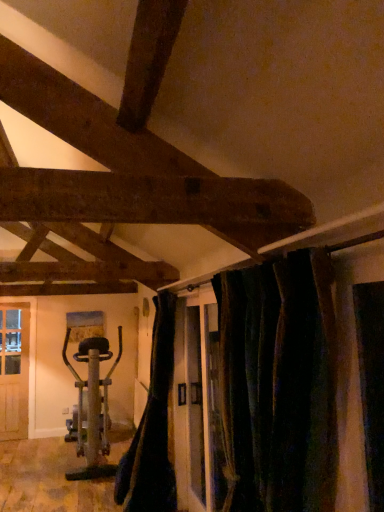
Where is `black fabric curtain at lower center, the 1th curtain when ordered from back to front`? Image resolution: width=384 pixels, height=512 pixels. black fabric curtain at lower center, the 1th curtain when ordered from back to front is located at coordinates (152, 426).

Is metallic silver exercise bike at left oriented away from black fabric curtain at lower center, the 1th curtain when ordered from back to front?

That's not correct — metallic silver exercise bike at left is not looking away from black fabric curtain at lower center, the 1th curtain when ordered from back to front.

Considering the positions of point (119, 352) and point (154, 322), is point (119, 352) closer or farther from the camera than point (154, 322)?

Point (119, 352) is positioned farther from the camera compared to point (154, 322).

Is metallic silver exercise bike at left a part of dark velvet curtains at center, which is the 1th curtain from front to back?

No, metallic silver exercise bike at left is not inside dark velvet curtains at center, which is the 1th curtain from front to back.

Does point (326, 458) come behind point (90, 425)?

No.

I want to click on sport equipment on the left of dark velvet curtains at center, which is the 1th curtain from front to back, so click(92, 402).

From the image's perspective, is dark velvet curtains at center, arranged as the second curtain when viewed from the back, positioned above or below metallic silver exercise bike at left?

dark velvet curtains at center, arranged as the second curtain when viewed from the back, is situated higher than metallic silver exercise bike at left in the image.

Find the location of a particular element. The width and height of the screenshot is (384, 512). sport equipment on the left of dark velvet curtains at center, which ranks as the 2th curtain in left-to-right order is located at coordinates (92, 402).

From the picture: Considering the relative sizes of metallic silver exercise bike at left and dark velvet curtains at center, which is the 1th curtain from front to back, in the image provided, is metallic silver exercise bike at left smaller than dark velvet curtains at center, which is the 1th curtain from front to back,?

No.

How different are the orientations of metallic silver exercise bike at left and dark velvet curtains at center, arranged as the second curtain when viewed from the back, in degrees?

metallic silver exercise bike at left and dark velvet curtains at center, arranged as the second curtain when viewed from the back, are facing 0.199 degrees away from each other.

From the image's perspective, who appears lower, metallic silver exercise bike at left or dark velvet curtains at center, the 1th curtain in the right-to-left sequence?

metallic silver exercise bike at left appears lower in the image.

From the picture: Which object is positioned more to the left, dark velvet curtains at center, which is the 1th curtain from front to back, or black fabric curtain at lower center, the 1th curtain when ordered from back to front?

Positioned to the left is black fabric curtain at lower center, the 1th curtain when ordered from back to front.

Based on the photo, from the image's perspective, is dark velvet curtains at center, which is the 1th curtain from front to back, under black fabric curtain at lower center, which appears as the second curtain when viewed from the right?

No, from the image's perspective, dark velvet curtains at center, which is the 1th curtain from front to back, is not below black fabric curtain at lower center, which appears as the second curtain when viewed from the right.

Identify the location of curtain behind the dark velvet curtains at center, arranged as the second curtain when viewed from the back. (152, 426).

Is black fabric curtain at lower center, which appears as the second curtain when viewed from the right, a part of dark velvet curtains at center, which is the 1th curtain from front to back?

No.

Considering the relative sizes of black fabric curtain at lower center, placed as the first curtain when sorted from left to right, and metallic silver exercise bike at left in the image provided, is black fabric curtain at lower center, placed as the first curtain when sorted from left to right, bigger than metallic silver exercise bike at left?

Incorrect, black fabric curtain at lower center, placed as the first curtain when sorted from left to right, is not larger than metallic silver exercise bike at left.

Based on the photo, considering the relative positions of black fabric curtain at lower center, the second curtain when ordered from front to back, and metallic silver exercise bike at left in the image provided, is black fabric curtain at lower center, the second curtain when ordered from front to back, behind metallic silver exercise bike at left?

No, black fabric curtain at lower center, the second curtain when ordered from front to back, is closer to the viewer.

Starting from the metallic silver exercise bike at left, which curtain is the 1st one to the right? Please provide its 2D coordinates.

[(152, 426)]

Based on the photo, from a real-world perspective, which is physically above, black fabric curtain at lower center, placed as the first curtain when sorted from left to right, or metallic silver exercise bike at left?

From a 3D spatial view, black fabric curtain at lower center, placed as the first curtain when sorted from left to right, is above.

In the scene shown: Is black fabric curtain at lower center, which appears as the second curtain when viewed from the right, to the left of dark velvet curtains at center, which ranks as the 2th curtain in left-to-right order, from the viewer's perspective?

Yes.

From a real-world perspective, is black fabric curtain at lower center, which appears as the second curtain when viewed from the right, above or below dark velvet curtains at center, the 1th curtain in the right-to-left sequence?

black fabric curtain at lower center, which appears as the second curtain when viewed from the right, is situated lower than dark velvet curtains at center, the 1th curtain in the right-to-left sequence, in the real world.

Which is nearer, (173, 303) or (293, 367)?

Point (173, 303) appears to be farther away from the viewer than point (293, 367).

Consider the image. Between black fabric curtain at lower center, the 1th curtain when ordered from back to front, and dark velvet curtains at center, which ranks as the 2th curtain in left-to-right order, which one is positioned behind?

black fabric curtain at lower center, the 1th curtain when ordered from back to front, is more distant.

The image size is (384, 512). Find the location of `the 1st curtain positioned above the metallic silver exercise bike at left (from the image's perspective)`. the 1st curtain positioned above the metallic silver exercise bike at left (from the image's perspective) is located at coordinates (152, 426).

I want to click on the 2nd curtain in front of the metallic silver exercise bike at left, so click(x=278, y=384).

Looking at the image, which one is located further to black fabric curtain at lower center, the 1th curtain when ordered from back to front, metallic silver exercise bike at left or dark velvet curtains at center, which ranks as the 2th curtain in left-to-right order?

Among the two, dark velvet curtains at center, which ranks as the 2th curtain in left-to-right order, is located further to black fabric curtain at lower center, the 1th curtain when ordered from back to front.

Estimate the real-world distances between objects in this image. Which object is further from metallic silver exercise bike at left, black fabric curtain at lower center, the second curtain when ordered from front to back, or dark velvet curtains at center, arranged as the second curtain when viewed from the back?

Among the two, dark velvet curtains at center, arranged as the second curtain when viewed from the back, is located further to metallic silver exercise bike at left.

Looking at the image, which one is located closer to dark velvet curtains at center, arranged as the second curtain when viewed from the back, metallic silver exercise bike at left or black fabric curtain at lower center, placed as the first curtain when sorted from left to right?

black fabric curtain at lower center, placed as the first curtain when sorted from left to right, is positioned closer to the anchor dark velvet curtains at center, arranged as the second curtain when viewed from the back.

Based on the photo, looking at the image, which one is located closer to metallic silver exercise bike at left, dark velvet curtains at center, which is the 1th curtain from front to back, or black fabric curtain at lower center, which appears as the second curtain when viewed from the right?

Among the two, black fabric curtain at lower center, which appears as the second curtain when viewed from the right, is located nearer to metallic silver exercise bike at left.

Looking at the image, which one is located further to black fabric curtain at lower center, which appears as the second curtain when viewed from the right, dark velvet curtains at center, arranged as the second curtain when viewed from the back, or metallic silver exercise bike at left?

dark velvet curtains at center, arranged as the second curtain when viewed from the back.

Estimate the real-world distances between objects in this image. Which object is closer to dark velvet curtains at center, the 1th curtain in the right-to-left sequence, black fabric curtain at lower center, which appears as the second curtain when viewed from the right, or metallic silver exercise bike at left?

Among the two, black fabric curtain at lower center, which appears as the second curtain when viewed from the right, is located nearer to dark velvet curtains at center, the 1th curtain in the right-to-left sequence.

At what (x,y) coordinates should I click in order to perform the action: click on curtain between dark velvet curtains at center, arranged as the second curtain when viewed from the back, and metallic silver exercise bike at left, along the z-axis. Please return your answer as a coordinate pair (x, y). Looking at the image, I should click on (152, 426).